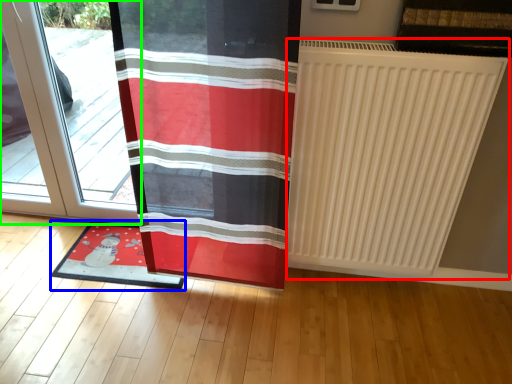
Question: Based on their relative distances, which object is farther from radiator (highlighted by a red box)? Choose from mat (highlighted by a blue box) and door (highlighted by a green box).

Choices:
 (A) mat
 (B) door

Answer: (B)